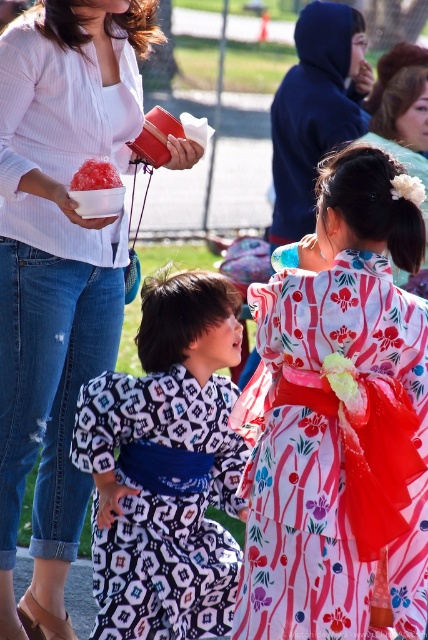
Is white floral kimono at center taller than shiny pink ice at center?

Yes.

Which of these two, white floral kimono at center or shiny pink ice at center, stands shorter?

shiny pink ice at center is shorter.

Between point (326, 314) and point (113, 172), which one is positioned behind?

Point (113, 172)

This screenshot has height=640, width=428. What are the coordinates of `white floral kimono at center` in the screenshot? It's located at (315, 445).

Is white ribbed sweater at upper left thinner than shiny pink ice at center?

In fact, white ribbed sweater at upper left might be wider than shiny pink ice at center.

Between white ribbed sweater at upper left and shiny pink ice at center, which one has more height?

white ribbed sweater at upper left is taller.

The height and width of the screenshot is (640, 428). I want to click on white ribbed sweater at upper left, so click(x=58, y=269).

Locate an element on the screen. The height and width of the screenshot is (640, 428). white ribbed sweater at upper left is located at coordinates (58, 269).

Is patterned silk kimono at center to the left of shiny pink ice at center from the viewer's perspective?

Incorrect, patterned silk kimono at center is not on the left side of shiny pink ice at center.

Does patterned silk kimono at center appear on the right side of shiny pink ice at center?

Yes, patterned silk kimono at center is to the right of shiny pink ice at center.

Measure the distance between point (x=232, y=348) and camera.

Point (x=232, y=348) is 4.11 meters away from camera.

The height and width of the screenshot is (640, 428). Identify the location of patterned silk kimono at center. (166, 467).